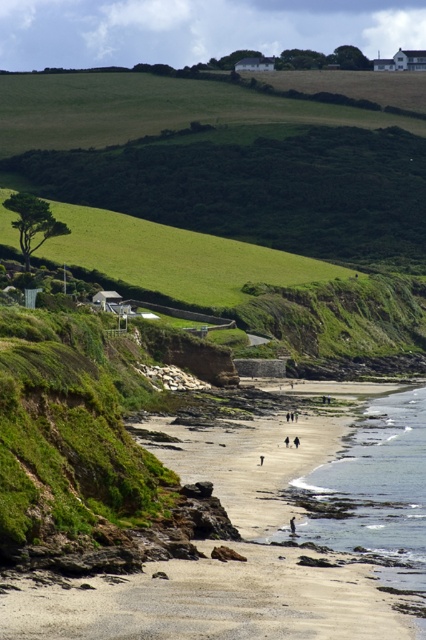
You are planning to build a small sandcastle on the beach. Given the sizes of the smooth sand beach at center and the clear water at beach center, which area would be more suitable for building your sandcastle and why?

The smooth sand beach at center is bigger than the clear water at beach center, so it would be more suitable for building a sandcastle because it provides a larger dry area to work with.